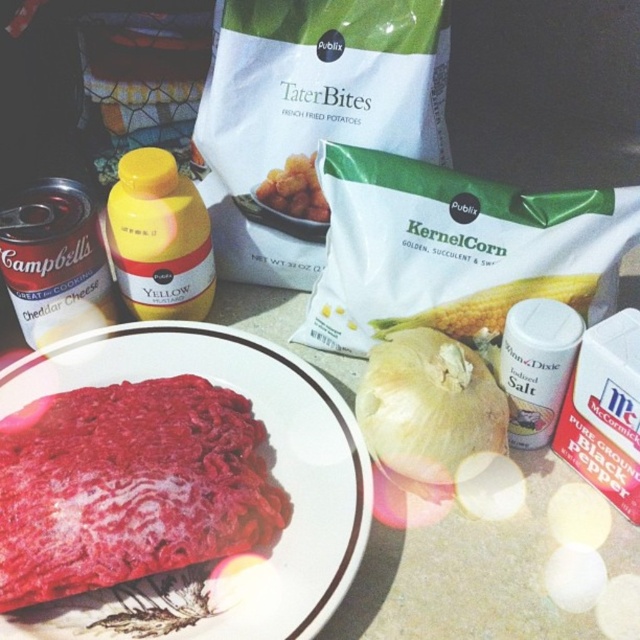
Does smooth ceramic plate at center come in front of golden crispy tater bites at center?

Yes.

Can you confirm if smooth ceramic plate at center is positioned to the right of golden crispy tater bites at center?

No, smooth ceramic plate at center is not to the right of golden crispy tater bites at center.

Locate an element on the screen. This screenshot has height=640, width=640. smooth ceramic plate at center is located at coordinates (268, 465).

Does point (132, 294) come farther from viewer compared to point (276, 179)?

That is True.

Who is more distant from viewer, (147, 257) or (307, 216)?

Positioned behind is point (307, 216).

This screenshot has width=640, height=640. I want to click on yellow plastic bottle at center, so click(160, 237).

Identify the location of white matte corn at center. The height and width of the screenshot is (640, 640). (493, 307).

Is white matte corn at center to the left of golden crispy tater bites at center from the viewer's perspective?

In fact, white matte corn at center is to the right of golden crispy tater bites at center.

Describe the element at coordinates (493, 307) in the screenshot. I see `white matte corn at center` at that location.

Find the location of a particular element. The image size is (640, 640). white matte corn at center is located at coordinates pos(493,307).